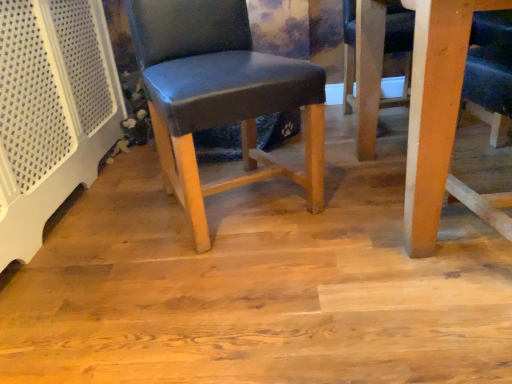
You are a GUI agent. You are given a task and a screenshot of the screen. Output one action in this format:
    pyautogui.click(x=<x>, y=<y>)
    Task: Click on the free space above matte wood floor at center (from a real-world perspective)
    The width and height of the screenshot is (512, 384).
    Given the screenshot: What is the action you would take?
    coord(253,226)